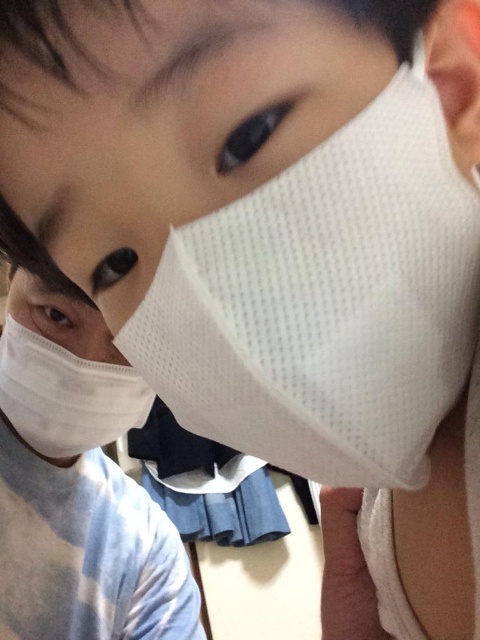
Can you confirm if white mesh mask at left is shorter than white mesh nose at center?

No.

From the picture: Measure the distance from white mesh mask at left to white mesh nose at center.

They are 2.04 inches apart.

Which is in front, point (16, 292) or point (111, 346)?

Point (111, 346) is more forward.

Image resolution: width=480 pixels, height=640 pixels. I want to click on white mesh mask at left, so click(x=63, y=372).

Does white mesh mask at center appear over white mesh mask at left?

Yes, white mesh mask at center is above white mesh mask at left.

Is point (253, 168) positioned behind point (24, 360)?

No, (253, 168) is in front of (24, 360).

At what (x,y) coordinates should I click in order to perform the action: click on white mesh mask at center. Please return your answer as a coordinate pair (x, y). Looking at the image, I should click on (163, 120).

Who is positioned more to the left, white mesh mask at center or white mesh nose at center?

white mesh nose at center

Measure the distance between white mesh mask at center and camera.

A distance of 7.74 inches exists between white mesh mask at center and camera.

What are the coordinates of `white mesh mask at center` in the screenshot? It's located at (163, 120).